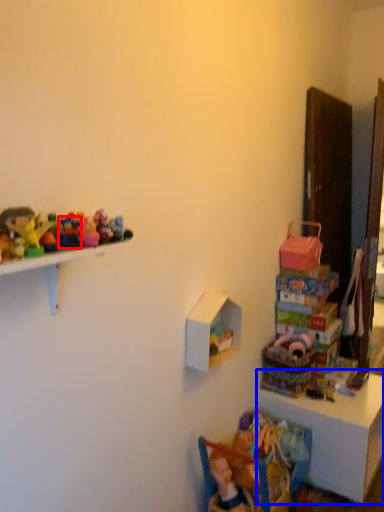
Question: Which object is closer to the camera taking this photo, toy (highlighted by a red box) or table (highlighted by a blue box)?

Choices:
 (A) toy
 (B) table

Answer: (A)